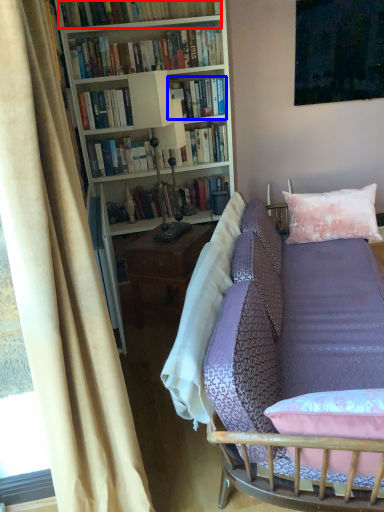
Question: Among these objects, which one is farthest to the camera, book (highlighted by a red box) or book (highlighted by a blue box)?

Choices:
 (A) book
 (B) book

Answer: (B)